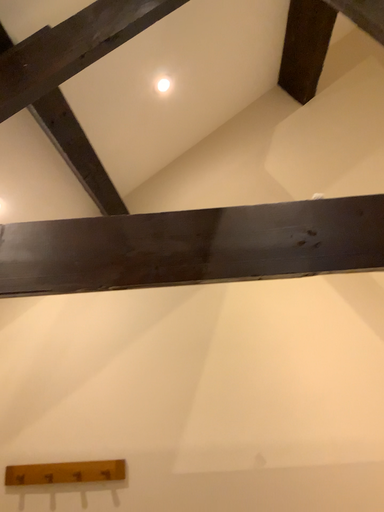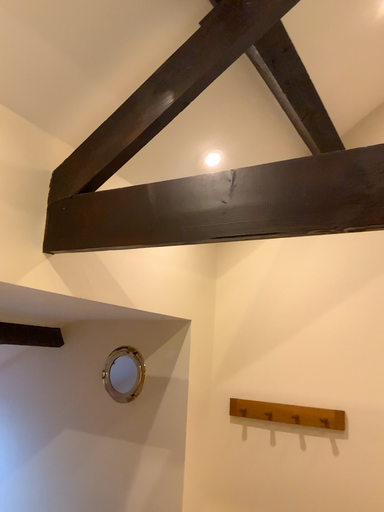
Question: How did the camera likely rotate when shooting the video?

Choices:
 (A) rotated downward
 (B) rotated upward

Answer: (A)